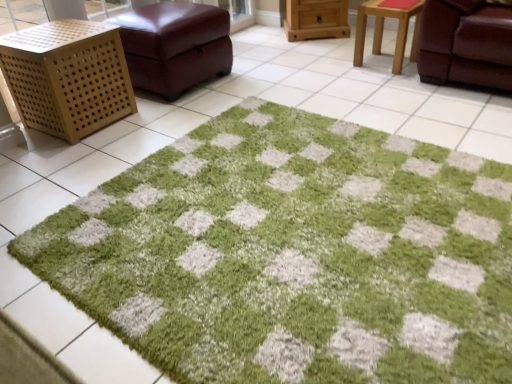
Question: Does wooden cabinet at upper center, which ranks as the 1th furniture in right-to-left order, contain green shaggy rug at center?

Choices:
 (A) yes
 (B) no

Answer: (B)

Question: Is wooden cabinet at upper center, the 3th furniture viewed from the left, aimed at green shaggy rug at center?

Choices:
 (A) no
 (B) yes

Answer: (B)

Question: Are wooden cabinet at upper center, the 3th furniture viewed from the left, and green shaggy rug at center located far from each other?

Choices:
 (A) no
 (B) yes

Answer: (B)

Question: Is wooden cabinet at upper center, the 3th furniture viewed from the left, bigger than green shaggy rug at center?

Choices:
 (A) no
 (B) yes

Answer: (A)

Question: Does wooden cabinet at upper center, the 3th furniture viewed from the left, appear on the right side of green shaggy rug at center?

Choices:
 (A) no
 (B) yes

Answer: (B)

Question: Looking at the image, does leather ottoman at upper left, placed as the 2th furniture when sorted from left to right, seem bigger or smaller compared to green shaggy rug at center?

Choices:
 (A) small
 (B) big

Answer: (B)

Question: Is leather ottoman at upper left, the 2th furniture in the right-to-left sequence, to the left or to the right of green shaggy rug at center in the image?

Choices:
 (A) right
 (B) left

Answer: (B)

Question: From the image's perspective, is leather ottoman at upper left, placed as the 2th furniture when sorted from left to right, above or below green shaggy rug at center?

Choices:
 (A) below
 (B) above

Answer: (B)

Question: Would you say leather ottoman at upper left, placed as the 2th furniture when sorted from left to right, is inside or outside green shaggy rug at center?

Choices:
 (A) inside
 (B) outside

Answer: (B)

Question: Considering the positions of wooden cabinet at upper center, the 3th furniture viewed from the left, and wooden lattice cube at left, the 3th furniture in the right-to-left sequence, in the image, is wooden cabinet at upper center, the 3th furniture viewed from the left, wider or thinner than wooden lattice cube at left, the 3th furniture in the right-to-left sequence,?

Choices:
 (A) wide
 (B) thin

Answer: (B)

Question: Is wooden cabinet at upper center, which ranks as the 1th furniture in right-to-left order, taller or shorter than wooden lattice cube at left, marked as the first furniture in a left-to-right arrangement?

Choices:
 (A) tall
 (B) short

Answer: (B)

Question: From a real-world perspective, is wooden cabinet at upper center, which ranks as the 1th furniture in right-to-left order, above or below wooden lattice cube at left, the 3th furniture in the right-to-left sequence?

Choices:
 (A) below
 (B) above

Answer: (A)

Question: In the image, is wooden cabinet at upper center, the 3th furniture viewed from the left, positioned in front of or behind wooden lattice cube at left, the 3th furniture in the right-to-left sequence?

Choices:
 (A) front
 (B) behind

Answer: (B)

Question: From a real-world perspective, is green shaggy rug at center above or below wooden stool at upper right?

Choices:
 (A) above
 (B) below

Answer: (B)

Question: In the image, is green shaggy rug at center on the left side or the right side of wooden stool at upper right?

Choices:
 (A) left
 (B) right

Answer: (A)